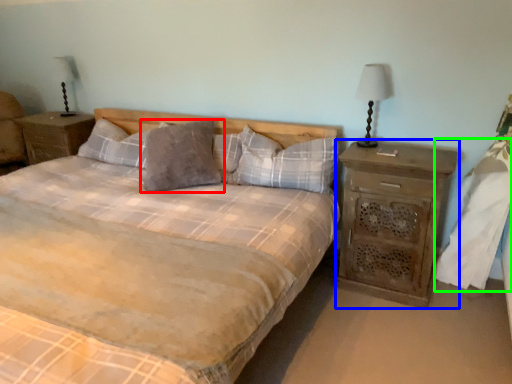
Question: Which object is positioned closest to pillow (highlighted by a red box)? Select from nightstand (highlighted by a blue box) and sheet (highlighted by a green box).

Choices:
 (A) nightstand
 (B) sheet

Answer: (A)